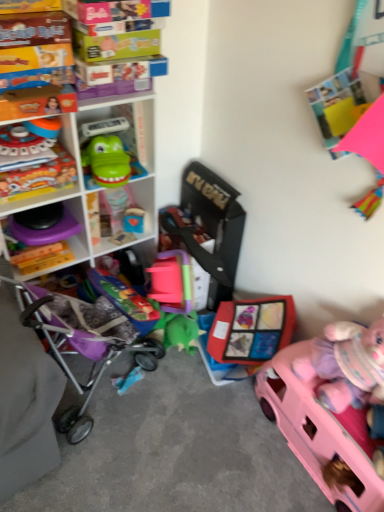
Identify the location of vacant space in front of matte plastic toy at center, arranged as the fifth toy when viewed from the left. This screenshot has height=512, width=384. (217, 408).